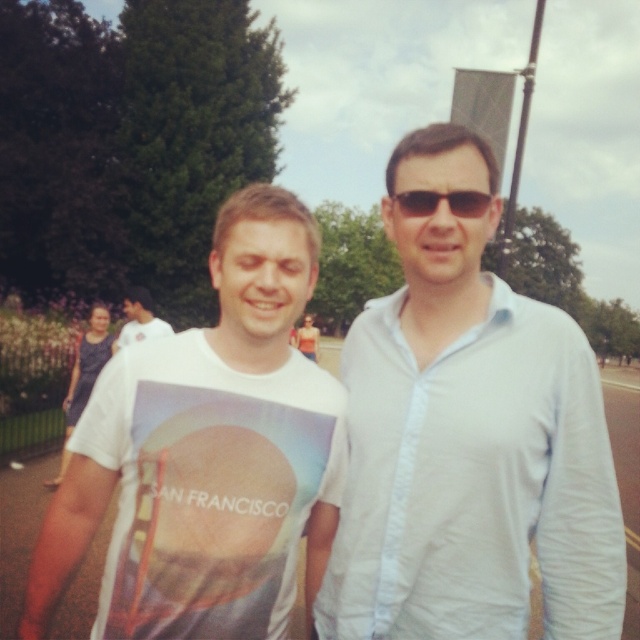
How far apart are white cotton shirt at center and white cotton t-shirt at center?

They are 16.30 inches apart.

Does point (364, 454) lie behind point (280, 244)?

Yes, it is.

Locate an element on the screen. This screenshot has width=640, height=640. white cotton shirt at center is located at coordinates (474, 483).

Looking at this image, is white cotton shirt at center to the right of white t-shirt at center from the viewer's perspective?

Correct, you'll find white cotton shirt at center to the right of white t-shirt at center.

Does white cotton shirt at center have a lesser width compared to white t-shirt at center?

Yes, white cotton shirt at center is thinner than white t-shirt at center.

Between point (385, 502) and point (144, 326), which one is positioned behind?

Positioned behind is point (144, 326).

Where is `white cotton shirt at center`? The image size is (640, 640). white cotton shirt at center is located at coordinates (474, 483).

Based on the photo, is white cotton shirt at center wider than sunglasses at center?

Yes.

What do you see at coordinates (474, 483) in the screenshot? I see `white cotton shirt at center` at bounding box center [474, 483].

Locate an element on the screen. The height and width of the screenshot is (640, 640). white cotton shirt at center is located at coordinates (474, 483).